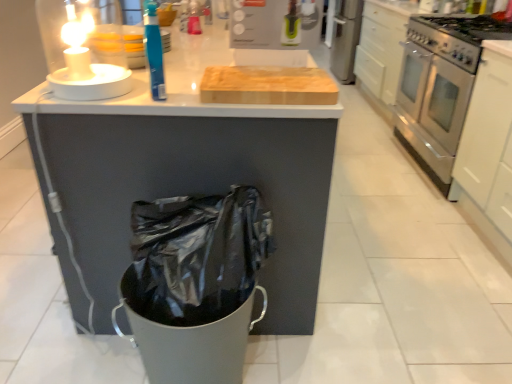
Question: Is stainless steel gas stove at right positioned before blue plastic bottle at upper center?

Choices:
 (A) yes
 (B) no

Answer: (B)

Question: Could blue plastic bottle at upper center be considered to be inside stainless steel gas stove at right?

Choices:
 (A) no
 (B) yes

Answer: (A)

Question: Is stainless steel gas stove at right positioned behind blue plastic bottle at upper center?

Choices:
 (A) yes
 (B) no

Answer: (A)

Question: From a real-world perspective, is stainless steel gas stove at right over blue plastic bottle at upper center?

Choices:
 (A) no
 (B) yes

Answer: (A)

Question: From a real-world perspective, is stainless steel gas stove at right positioned under blue plastic bottle at upper center based on gravity?

Choices:
 (A) no
 (B) yes

Answer: (B)

Question: Do you think white glossy counter at center is within stainless steel oven at right, or outside of it?

Choices:
 (A) inside
 (B) outside

Answer: (B)

Question: From a real-world perspective, is white glossy counter at center above or below stainless steel oven at right?

Choices:
 (A) below
 (B) above

Answer: (A)

Question: From their relative heights in the image, would you say white glossy counter at center is taller or shorter than stainless steel oven at right?

Choices:
 (A) short
 (B) tall

Answer: (A)

Question: In terms of size, does white glossy counter at center appear bigger or smaller than stainless steel oven at right?

Choices:
 (A) big
 (B) small

Answer: (A)

Question: Looking at their shapes, would you say white matte cabinet at right is wider or thinner than blue plastic bottle at upper center?

Choices:
 (A) thin
 (B) wide

Answer: (B)

Question: Would you say white matte cabinet at right is to the left or to the right of blue plastic bottle at upper center in the picture?

Choices:
 (A) right
 (B) left

Answer: (A)

Question: From a real-world perspective, is white matte cabinet at right positioned above or below blue plastic bottle at upper center?

Choices:
 (A) below
 (B) above

Answer: (A)

Question: In the image, is white matte cabinet at right positioned in front of or behind blue plastic bottle at upper center?

Choices:
 (A) behind
 (B) front

Answer: (A)

Question: Considering their positions, is stainless steel oven at right located in front of or behind stainless steel gas stove at right?

Choices:
 (A) front
 (B) behind

Answer: (B)

Question: From their relative heights in the image, would you say stainless steel oven at right is taller or shorter than stainless steel gas stove at right?

Choices:
 (A) tall
 (B) short

Answer: (A)